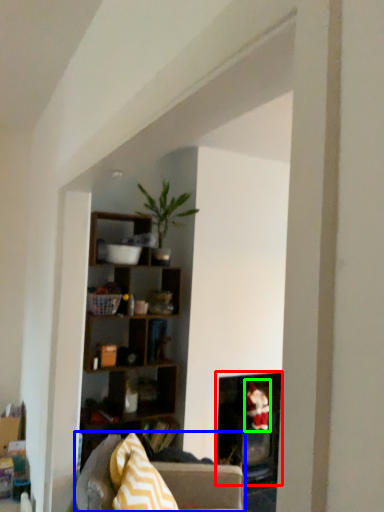
Question: Which object is the closest to the fireplace (highlighted by a red box)? Choose among these: studio couch (highlighted by a blue box) or toy (highlighted by a green box).

Choices:
 (A) studio couch
 (B) toy

Answer: (B)